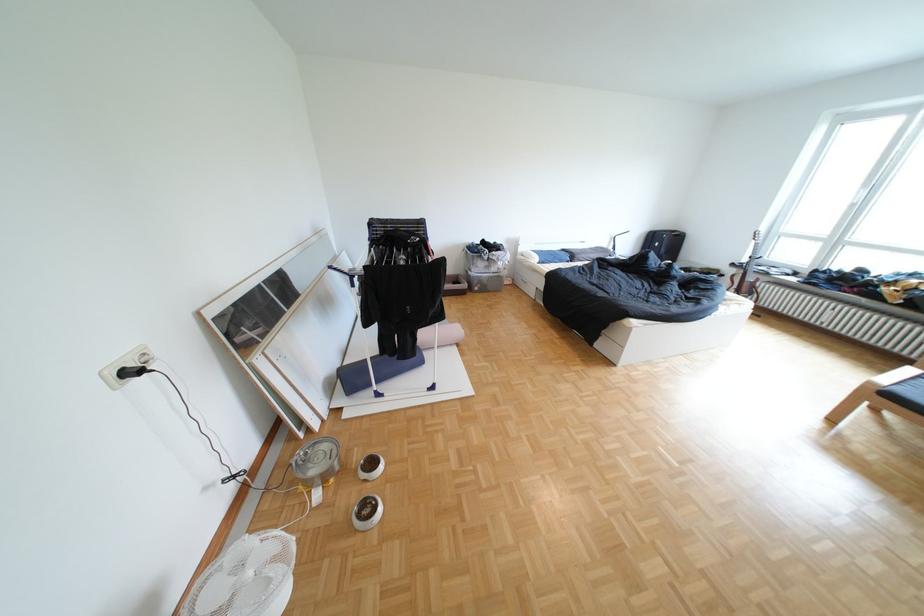
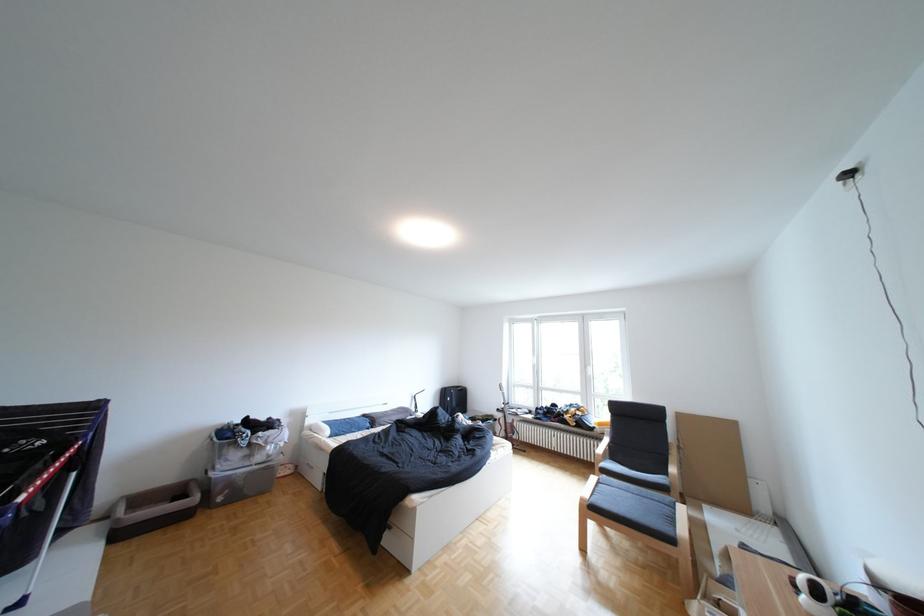
The images are taken continuously from a first-person perspective. In which direction is your viewpoint rotating?

The rotation direction of the camera is right-up.